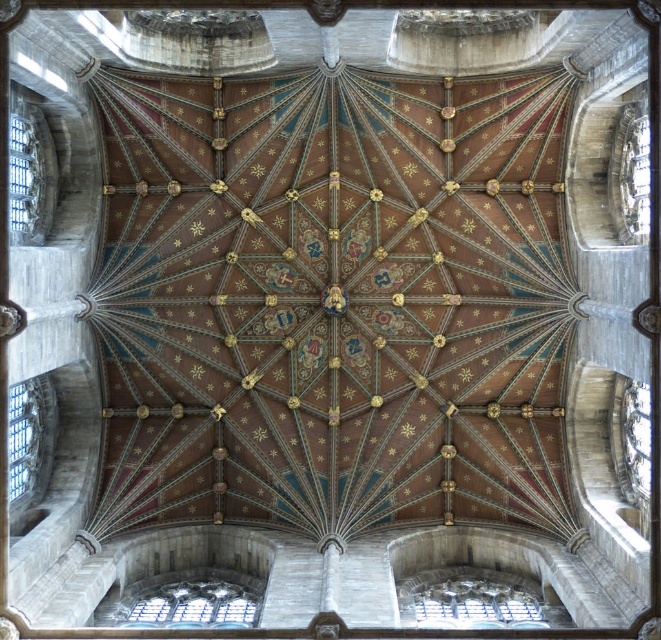
Does transparent glass window at lower center have a larger size compared to transparent glass window at left?

No, transparent glass window at lower center is not bigger than transparent glass window at left.

Can you confirm if transparent glass window at lower center is taller than transparent glass window at left?

Incorrect, transparent glass window at lower center's height is not larger of transparent glass window at left's.

Where is `transparent glass window at lower center`? transparent glass window at lower center is located at coordinates (467, 600).

Identify the location of transparent glass window at lower center. (467, 600).

Measure the distance from transparent glass window at lower center to clear glass window at lower left.

23.17 meters

Does transparent glass window at lower center have a greater width compared to clear glass window at lower left?

Yes, transparent glass window at lower center is wider than clear glass window at lower left.

Which is in front, point (486, 577) or point (243, 596)?

Point (243, 596) is in front.

At what (x,y) coordinates should I click in order to perform the action: click on transparent glass window at lower center. Please return your answer as a coordinate pair (x, y). Looking at the image, I should click on coord(467,600).

Does clear glass window at lower left have a greater height compared to transparent glass window at left?

No.

Is point (208, 604) farther from viewer compared to point (9, 419)?

Yes.

This screenshot has height=640, width=661. Identify the location of clear glass window at lower left. (196, 605).

Find the location of a particular element. The height and width of the screenshot is (640, 661). clear glass window at lower left is located at coordinates (196, 605).